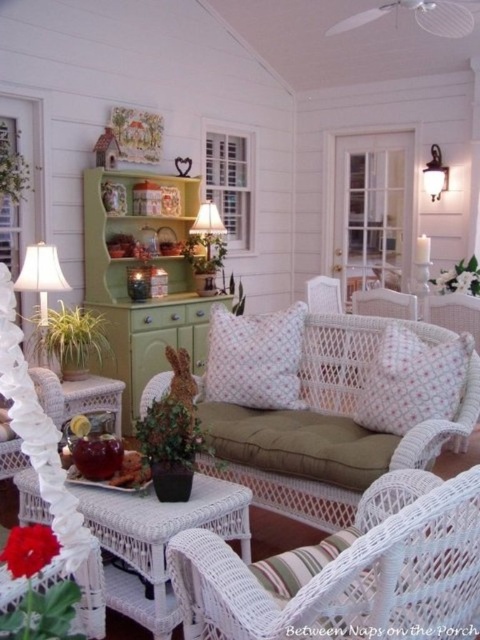
Question: Is white wicker armchair at lower center below white wicker couch at center?

Choices:
 (A) yes
 (B) no

Answer: (A)

Question: Which object appears closest to the camera in this image?

Choices:
 (A) white wicker armchair at center
 (B) white wicker armchair at lower center
 (C) white wicker couch at center
 (D) pink dotted fabric pillow at center

Answer: (B)

Question: Which object is farther from the camera taking this photo?

Choices:
 (A) white wicker couch at center
 (B) white fabric lampshade at left
 (C) white matte wall sconce at upper right

Answer: (C)

Question: Does white wicker couch at center have a lesser width compared to white fabric lampshade at left?

Choices:
 (A) yes
 (B) no

Answer: (B)

Question: Which object is positioned farthest from the white dotted pillow at center?

Choices:
 (A) white wicker couch at center
 (B) white wicker armchair at lower center
 (C) white matte wall sconce at upper right

Answer: (C)

Question: Is white wicker armchair at lower center bigger than white dotted pillow at center?

Choices:
 (A) yes
 (B) no

Answer: (A)